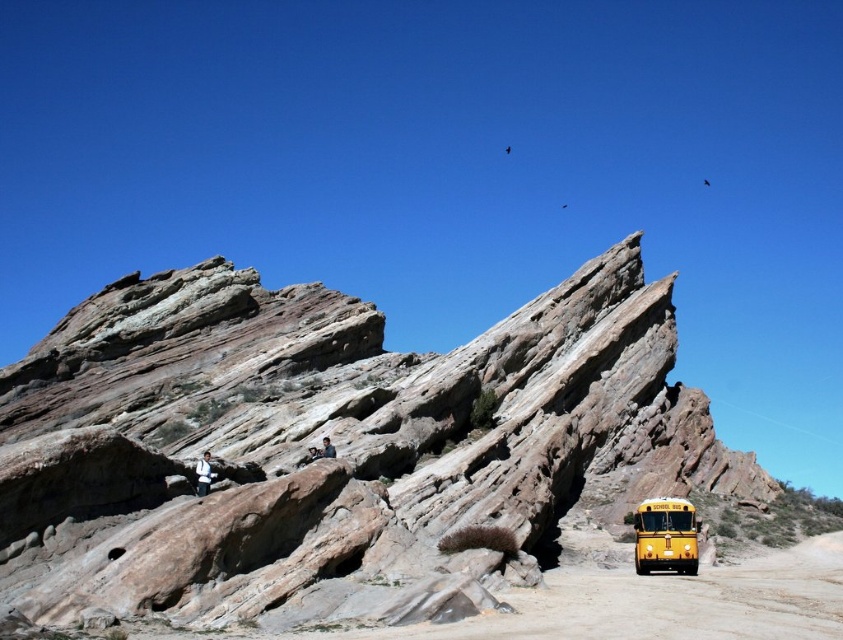
Question: In this image, where is rusty rock formation at center located relative to yellow matte school bus at lower right?

Choices:
 (A) below
 (B) above

Answer: (B)

Question: Which point appears farthest from the camera in this image?

Choices:
 (A) (693, 556)
 (B) (428, 422)

Answer: (B)

Question: Is rusty rock formation at center thinner than yellow matte school bus at lower right?

Choices:
 (A) no
 (B) yes

Answer: (A)

Question: Among these points, which one is nearest to the camera?

Choices:
 (A) (17, 572)
 (B) (680, 515)

Answer: (A)

Question: Does rusty rock formation at center appear under yellow matte school bus at lower right?

Choices:
 (A) no
 (B) yes

Answer: (A)

Question: Which object is closer to the camera taking this photo?

Choices:
 (A) rusty rock formation at center
 (B) yellow matte school bus at lower right

Answer: (A)